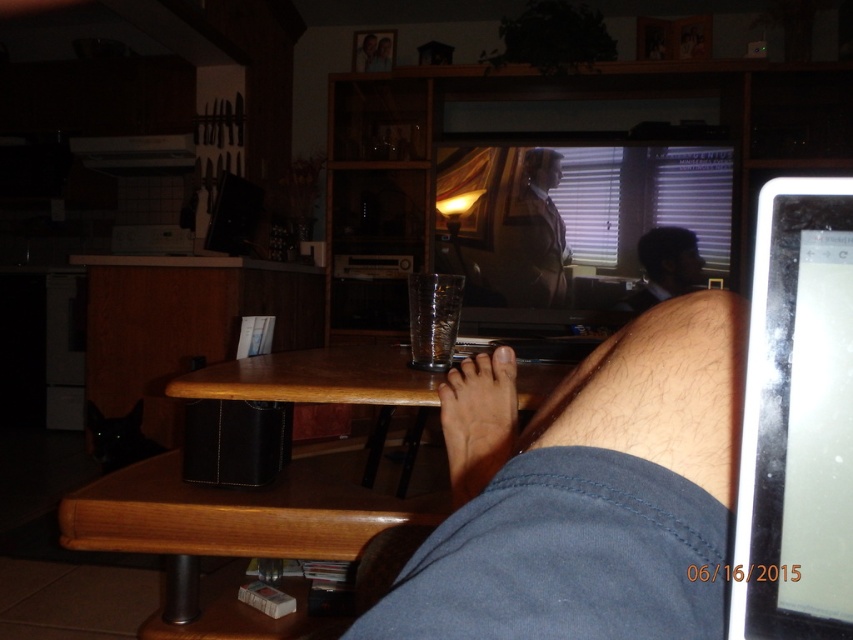
You are a home security camera monitoring the room. You see the matte black tablet at right and the brown skin at lower center. Which object is taller?

The matte black tablet at right is taller than brown skin at lower center.

What object is located at the coordinates point (798, 419)?

The object at point (798, 419) is a matte black tablet at right.

You are a home security camera monitoring the living room. You notice the hairy skin at lower right and the matte black tablet at right. Which object is taller?

The matte black tablet at right is taller than the hairy skin at lower right.